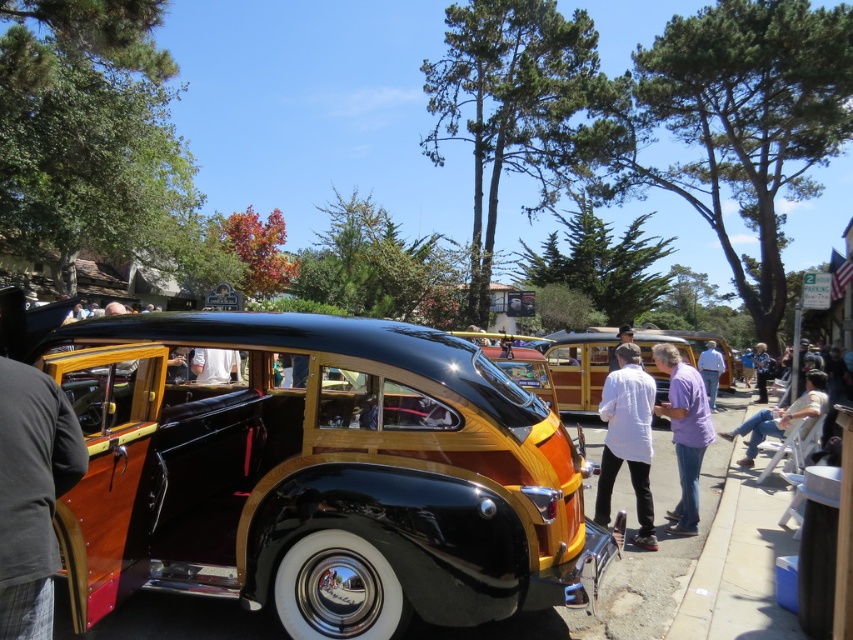
You are a tailor who needs to determine which fabric is more suitable for making a lightweight summer jacket. Based on the image, which fabric belongs to the gray fabric shirt at lower left or the light beige fabric chair at right?

The gray fabric shirt at lower left is thinner than the light beige fabric chair at right, so the gray fabric shirt at lower left is more suitable for a lightweight summer jacket.

You are standing at the point with coordinates point [810,404] and want to walk to the car parked in the park. Can you see the car through the open rear door of the car at point [637,445]?

Point [637,445] is in front of point [810,404], so yes, you can see the car through the open rear door of the car at point [637,445] because it is positioned in front of your current location.